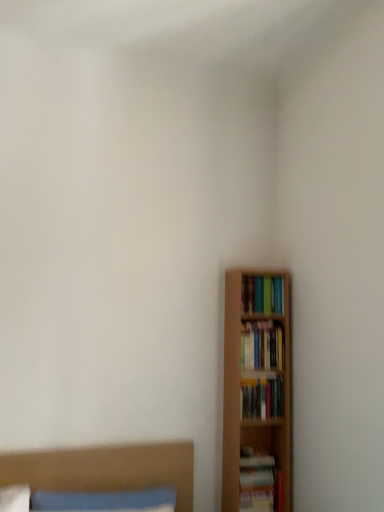
Image resolution: width=384 pixels, height=512 pixels. Find the location of `vacant space situated above hardcover books at right, which ranks as the 3th book in top-to-bottom order (from a real-world perspective)`. vacant space situated above hardcover books at right, which ranks as the 3th book in top-to-bottom order (from a real-world perspective) is located at coordinates [265, 380].